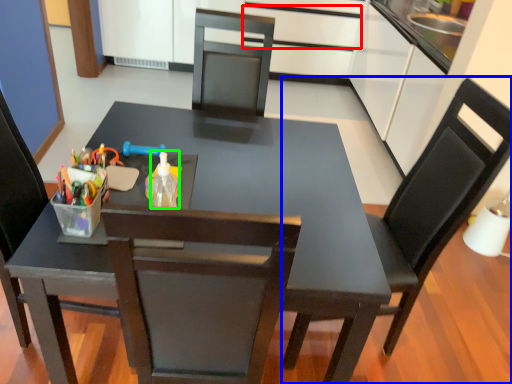
Question: Based on their relative distances, which object is nearer to drawer (highlighted by a red box)? Choose from chair (highlighted by a blue box) and bottle (highlighted by a green box).

Choices:
 (A) chair
 (B) bottle

Answer: (A)